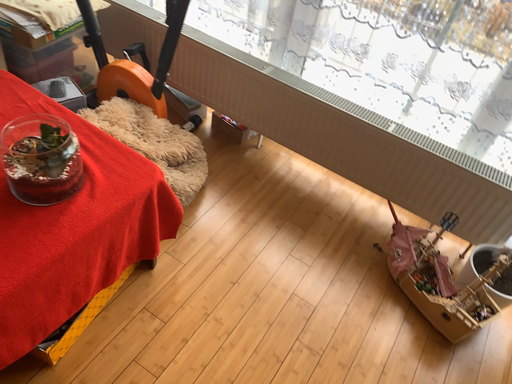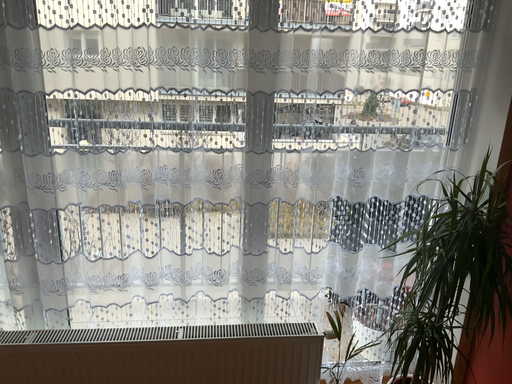
Question: How did the camera likely rotate when shooting the video?

Choices:
 (A) rotated left
 (B) rotated right

Answer: (B)